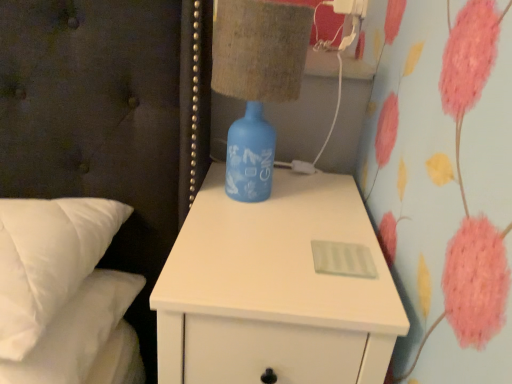
Question: From a real-world perspective, is white plastic electric outlet at upper right over white matte nightstand at center?

Choices:
 (A) no
 (B) yes

Answer: (B)

Question: Is white plastic electric outlet at upper right at the right side of white matte nightstand at center?

Choices:
 (A) no
 (B) yes

Answer: (B)

Question: Considering the relative sizes of white plastic electric outlet at upper right and white matte nightstand at center in the image provided, is white plastic electric outlet at upper right bigger than white matte nightstand at center?

Choices:
 (A) yes
 (B) no

Answer: (B)

Question: Does white plastic electric outlet at upper right have a greater height compared to white matte nightstand at center?

Choices:
 (A) no
 (B) yes

Answer: (A)

Question: Is white plastic electric outlet at upper right smaller than white matte nightstand at center?

Choices:
 (A) no
 (B) yes

Answer: (B)

Question: Is white plastic electric outlet at upper right touching white matte nightstand at center?

Choices:
 (A) no
 (B) yes

Answer: (A)

Question: Is white matte nightstand at center positioned in front of white plastic electric outlet at upper right?

Choices:
 (A) no
 (B) yes

Answer: (B)

Question: Is white matte nightstand at center far from white plastic electric outlet at upper right?

Choices:
 (A) no
 (B) yes

Answer: (A)

Question: Does white matte nightstand at center have a smaller size compared to white plastic electric outlet at upper right?

Choices:
 (A) yes
 (B) no

Answer: (B)

Question: Is white matte nightstand at center not within white plastic electric outlet at upper right?

Choices:
 (A) no
 (B) yes

Answer: (B)

Question: Can you confirm if white matte nightstand at center is wider than white plastic electric outlet at upper right?

Choices:
 (A) yes
 (B) no

Answer: (A)

Question: From the image's perspective, would you say white matte nightstand at center is shown under white plastic electric outlet at upper right?

Choices:
 (A) yes
 (B) no

Answer: (A)

Question: Considering the relative positions of white soft pillows at left and white matte nightstand at center in the image provided, is white soft pillows at left to the right of white matte nightstand at center from the viewer's perspective?

Choices:
 (A) yes
 (B) no

Answer: (B)